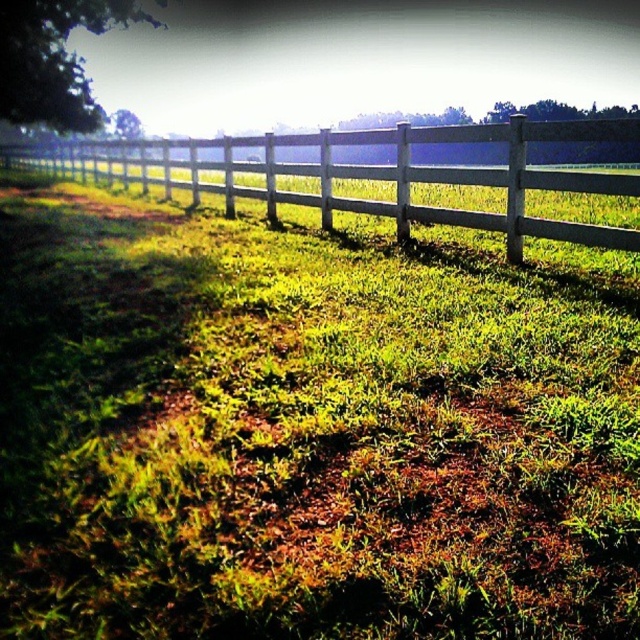
Looking at this image, you are a gardener standing in the middle of the scene. You need to mow the green grassy at center and the white wooden fence at upper center. Which area should you mow first based on their positions?

The green grassy at center should be mowed first because it is in front of the white wooden fence at upper center, making it accessible before reaching the fence.